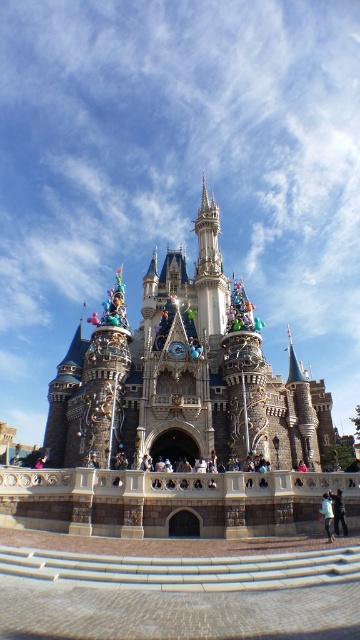
Question: Which point is closer to the camera?

Choices:
 (A) stone castle at center
 (B) light blue denim jeans at lower right

Answer: (B)

Question: Which object appears closest to the camera in this image?

Choices:
 (A) light blue denim jacket at lower right
 (B) light blue denim jeans at lower right

Answer: (A)

Question: Is light blue denim jeans at lower right thinner than light blue denim jacket at lower right?

Choices:
 (A) no
 (B) yes

Answer: (A)

Question: Where is stone castle at center located in relation to light blue denim jeans at lower right in the image?

Choices:
 (A) below
 (B) above

Answer: (B)

Question: Estimate the real-world distances between objects in this image. Which object is farther from the light blue denim jacket at lower right?

Choices:
 (A) light blue denim jeans at lower right
 (B) stone castle at center

Answer: (B)

Question: Does stone castle at center appear over light blue denim jacket at lower right?

Choices:
 (A) yes
 (B) no

Answer: (A)